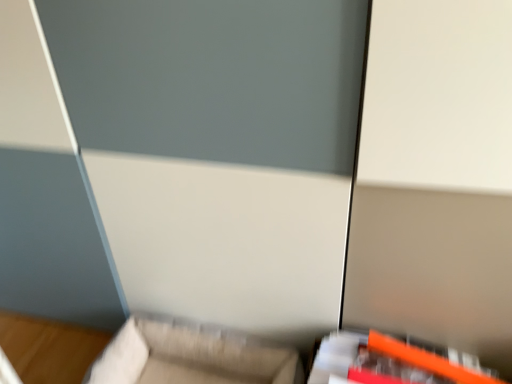
Question: Is orange plastic ruler at lower right, acting as the second furniture starting from the left, wider or thinner than beige fabric couch at lower center, the 2th furniture viewed from the right?

Choices:
 (A) thin
 (B) wide

Answer: (A)

Question: Which is correct: orange plastic ruler at lower right, which ranks as the first furniture in right-to-left order, is inside beige fabric couch at lower center, placed as the first furniture when sorted from left to right, or outside of it?

Choices:
 (A) inside
 (B) outside

Answer: (B)

Question: Considering their positions, is orange plastic ruler at lower right, which ranks as the first furniture in right-to-left order, located in front of or behind beige fabric couch at lower center, placed as the first furniture when sorted from left to right?

Choices:
 (A) behind
 (B) front

Answer: (B)

Question: From a real-world perspective, relative to orange plastic ruler at lower right, which ranks as the first furniture in right-to-left order, is beige fabric couch at lower center, the 2th furniture viewed from the right, vertically above or below?

Choices:
 (A) above
 (B) below

Answer: (B)

Question: Is beige fabric couch at lower center, the 2th furniture viewed from the right, wider or thinner than orange plastic ruler at lower right, acting as the second furniture starting from the left?

Choices:
 (A) thin
 (B) wide

Answer: (B)

Question: Is beige fabric couch at lower center, placed as the first furniture when sorted from left to right, taller or shorter than orange plastic ruler at lower right, which ranks as the first furniture in right-to-left order?

Choices:
 (A) tall
 (B) short

Answer: (A)

Question: Is point (125, 357) closer or farther from the camera than point (482, 380)?

Choices:
 (A) farther
 (B) closer

Answer: (A)